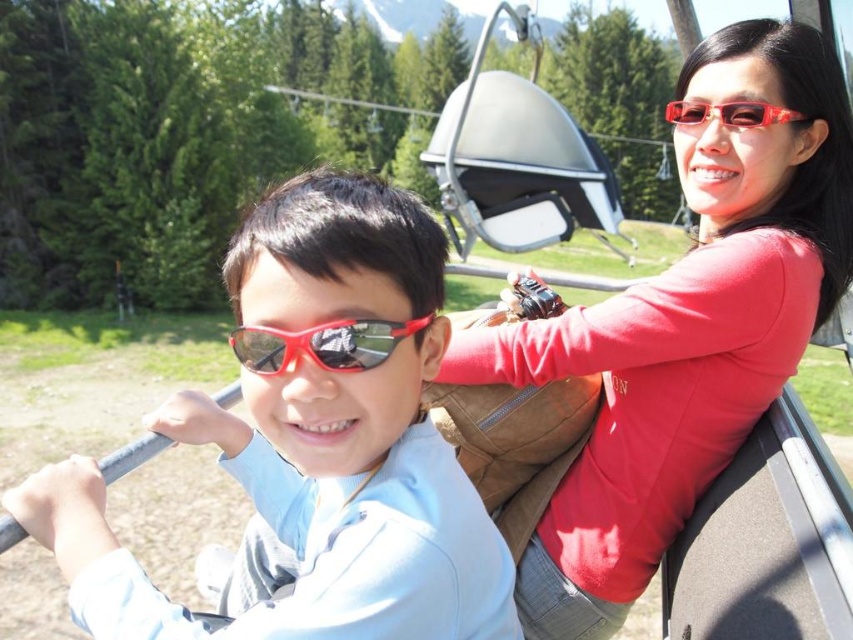
Question: Can you confirm if matte blue shirt at center is thinner than matte red sunglasses at center?

Choices:
 (A) yes
 (B) no

Answer: (B)

Question: Is matte blue shirt at center smaller than matte red sweater at upper right?

Choices:
 (A) yes
 (B) no

Answer: (A)

Question: Which object appears farthest from the camera in this image?

Choices:
 (A) matte red sunglasses at center
 (B) matte red sweater at upper right

Answer: (B)

Question: Among these objects, which one is nearest to the camera?

Choices:
 (A) matte red sunglasses at center
 (B) matte blue shirt at center
 (C) matte red sweater at upper right

Answer: (B)

Question: Among these objects, which one is nearest to the camera?

Choices:
 (A) matte red sunglasses at center
 (B) matte blue shirt at center
 (C) matte red sweater at upper right

Answer: (B)

Question: From the image, what is the correct spatial relationship of matte red sweater at upper right in relation to matte red sunglasses at center?

Choices:
 (A) right
 (B) left

Answer: (A)